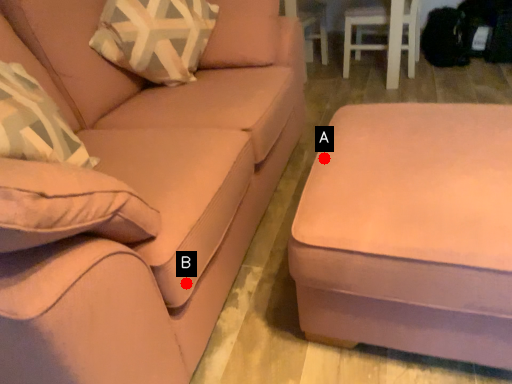
Question: Two points are circled on the image, labeled by A and B beside each circle. Which of the following is the farthest from the observer?

Choices:
 (A) A is further
 (B) B is further

Answer: (A)